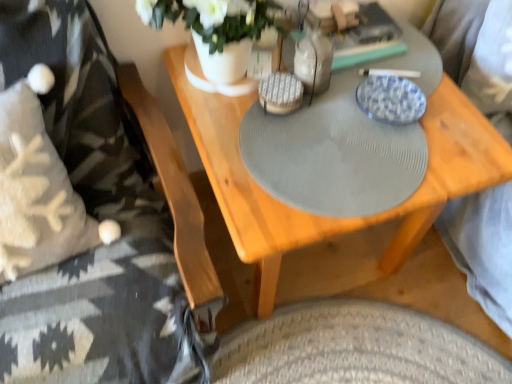
Question: Considering the relative positions of wooden table at center and knitted wool blanket at left in the image provided, is wooden table at center to the right of knitted wool blanket at left from the viewer's perspective?

Choices:
 (A) no
 (B) yes

Answer: (B)

Question: Considering the relative positions of wooden table at center and knitted wool blanket at left in the image provided, is wooden table at center to the left of knitted wool blanket at left from the viewer's perspective?

Choices:
 (A) yes
 (B) no

Answer: (B)

Question: Can you confirm if wooden table at center is bigger than knitted wool blanket at left?

Choices:
 (A) yes
 (B) no

Answer: (B)

Question: Is wooden table at center looking in the opposite direction of knitted wool blanket at left?

Choices:
 (A) no
 (B) yes

Answer: (A)

Question: Does wooden table at center lie behind knitted wool blanket at left?

Choices:
 (A) yes
 (B) no

Answer: (A)

Question: Does wooden table at center have a lesser width compared to knitted wool blanket at left?

Choices:
 (A) yes
 (B) no

Answer: (A)

Question: Is blue glazed plate at upper center at the right side of wooden table at center?

Choices:
 (A) yes
 (B) no

Answer: (A)

Question: Considering the relative sizes of blue glazed plate at upper center and wooden table at center in the image provided, is blue glazed plate at upper center taller than wooden table at center?

Choices:
 (A) no
 (B) yes

Answer: (A)

Question: Is blue glazed plate at upper center not near wooden table at center?

Choices:
 (A) no
 (B) yes

Answer: (A)

Question: From the image's perspective, is blue glazed plate at upper center located above wooden table at center?

Choices:
 (A) no
 (B) yes

Answer: (B)

Question: Would you say blue glazed plate at upper center is outside wooden table at center?

Choices:
 (A) no
 (B) yes

Answer: (B)

Question: From the image's perspective, is blue glazed plate at upper center below wooden table at center?

Choices:
 (A) yes
 (B) no

Answer: (B)

Question: Is white matte vase at upper center smaller than blue glazed plate at upper center?

Choices:
 (A) no
 (B) yes

Answer: (A)